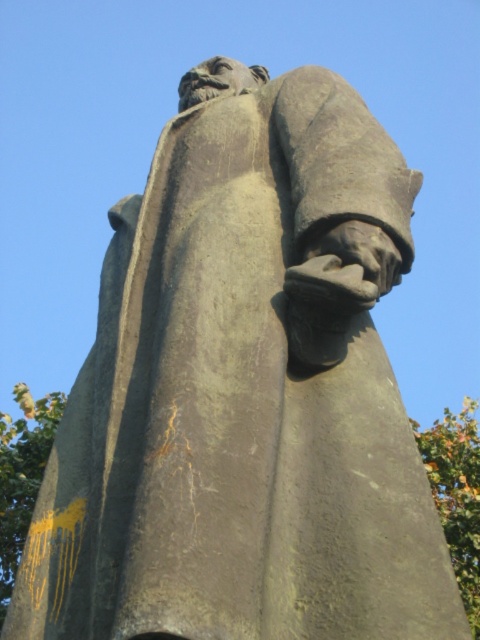
Question: Does green leafy tree at right lie behind green leafy tree at lower left?

Choices:
 (A) no
 (B) yes

Answer: (A)

Question: Considering the real-world distances, which object is closest to the green leafy tree at lower left?

Choices:
 (A) green leafy tree at center
 (B) green leafy tree at right

Answer: (A)

Question: Which point is closer to the camera taking this photo?

Choices:
 (A) (437, 422)
 (B) (44, 422)

Answer: (B)

Question: Which object is closer to the camera taking this photo?

Choices:
 (A) green leafy tree at center
 (B) green leafy tree at right

Answer: (B)

Question: Is green leafy tree at right to the left of green leafy tree at lower left from the viewer's perspective?

Choices:
 (A) yes
 (B) no

Answer: (B)

Question: Does green leafy tree at center have a lesser width compared to green leafy tree at right?

Choices:
 (A) no
 (B) yes

Answer: (A)